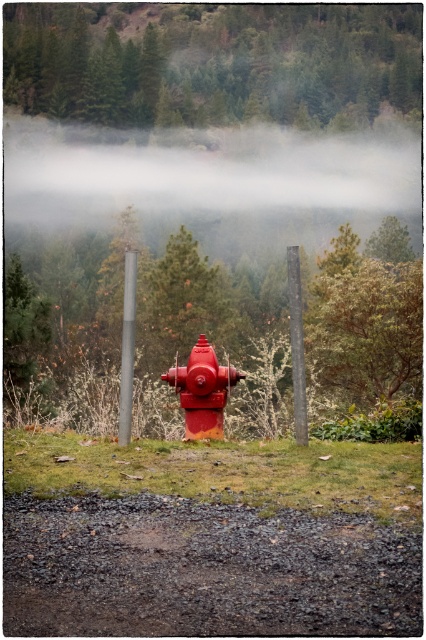
Question: Is metallic pole at center further to the viewer compared to smooth wooden post at center?

Choices:
 (A) yes
 (B) no

Answer: (B)

Question: Which point is closer to the camera?

Choices:
 (A) metallic pole at center
 (B) green textured bush at right

Answer: (A)

Question: Does matte red fire hydrant at center appear under metallic pole at center?

Choices:
 (A) no
 (B) yes

Answer: (B)

Question: Which of these objects is positioned closest to the matte red fire hydrant at center?

Choices:
 (A) green textured bush at right
 (B) green matte tree at upper center
 (C) metallic pole at center

Answer: (C)

Question: From the image, what is the correct spatial relationship of metallic pole at center in relation to smooth wooden post at center?

Choices:
 (A) above
 (B) below

Answer: (B)

Question: Which of the following is the farthest from the observer?

Choices:
 (A) matte red fire hydrant at center
 (B) green matte tree at upper center

Answer: (B)